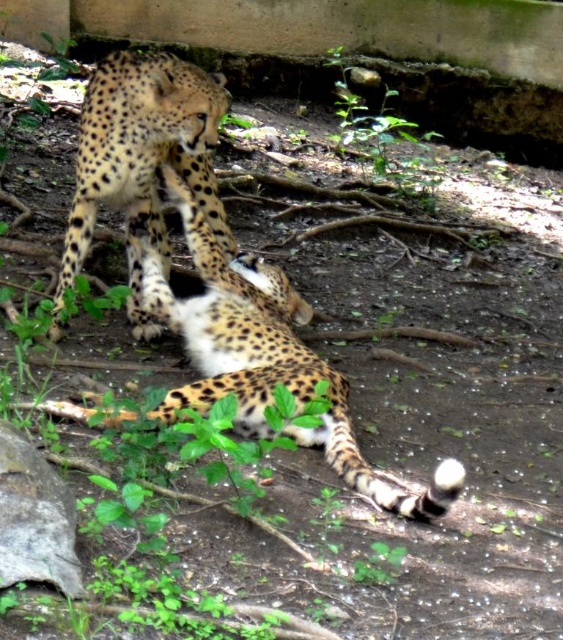
Question: Is spotted fur cheetah at center wider than spotted fur cheetah at upper center?

Choices:
 (A) yes
 (B) no

Answer: (A)

Question: Is spotted fur cheetah at center wider than spotted fur cheetah at upper center?

Choices:
 (A) no
 (B) yes

Answer: (B)

Question: Can you confirm if spotted fur cheetah at center is positioned to the left of spotted fur cheetah at upper center?

Choices:
 (A) yes
 (B) no

Answer: (B)

Question: Which of the following is the closest to the observer?

Choices:
 (A) spotted fur cheetah at upper center
 (B) spotted fur cheetah at center

Answer: (B)